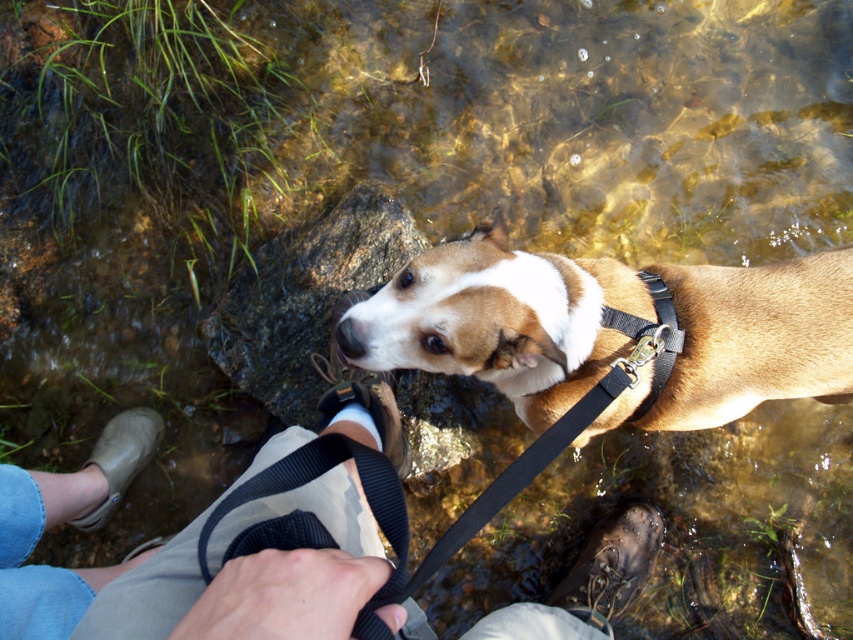
Does brown leather boot at lower right come behind brown leather shoe at center?

Yes, brown leather boot at lower right is behind brown leather shoe at center.

What are the coordinates of `brown leather boot at lower right` in the screenshot? It's located at click(611, 564).

Can you confirm if brown leather boot at lower right is wider than tan rubber boot at lower left?

Yes, brown leather boot at lower right is wider than tan rubber boot at lower left.

The image size is (853, 640). What do you see at coordinates (611, 564) in the screenshot?
I see `brown leather boot at lower right` at bounding box center [611, 564].

Who is more forward, (624,604) or (132,451)?

Point (624,604) is more forward.

Find the location of `brown leather boot at lower right`. brown leather boot at lower right is located at coordinates (611, 564).

Which of these two, brown matte dog at center or black nylon strap at lower center, stands taller?

brown matte dog at center

Does brown matte dog at center appear under black nylon strap at lower center?

Incorrect, brown matte dog at center is not positioned below black nylon strap at lower center.

Locate an element on the screen. The image size is (853, 640). brown matte dog at center is located at coordinates (611, 330).